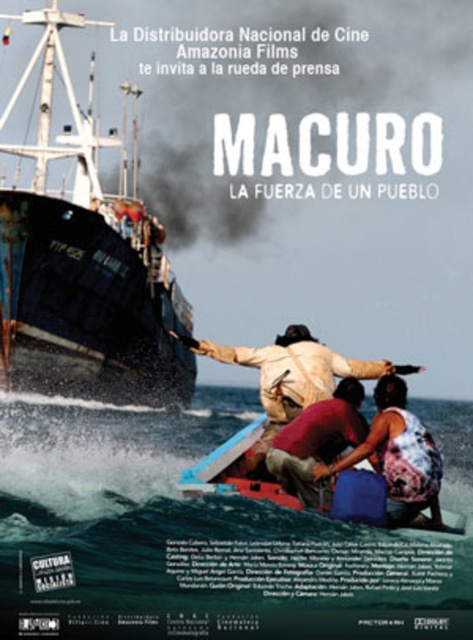
Question: Can you confirm if black matte ship at center is wider than brown leather jacket at center?

Choices:
 (A) yes
 (B) no

Answer: (A)

Question: Does clear blue water at lower center appear under brown leather jacket at center?

Choices:
 (A) yes
 (B) no

Answer: (A)

Question: Can you confirm if floral fabric dress at lower center is positioned below reddish-brown fabric shirt at center?

Choices:
 (A) yes
 (B) no

Answer: (A)

Question: Considering the real-world distances, which object is closest to the clear blue water at lower center?

Choices:
 (A) black matte ship at center
 (B) floral fabric dress at lower center
 (C) brown leather jacket at center
 (D) reddish-brown fabric shirt at center

Answer: (D)

Question: Which is nearer to the clear blue water at lower center?

Choices:
 (A) brown leather jacket at center
 (B) floral fabric dress at lower center
 (C) reddish-brown fabric shirt at center

Answer: (C)

Question: Based on their relative distances, which object is nearer to the brown leather jacket at center?

Choices:
 (A) black matte ship at center
 (B) reddish-brown fabric shirt at center

Answer: (B)